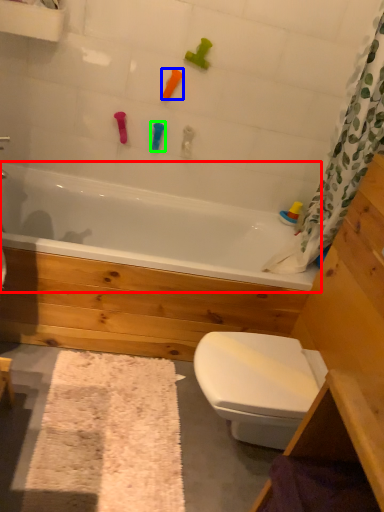
Question: Estimate the real-world distances between objects in this image. Which object is farther from bathtub (highlighted by a red box), toy (highlighted by a blue box) or toy (highlighted by a green box)?

Choices:
 (A) toy
 (B) toy

Answer: (A)